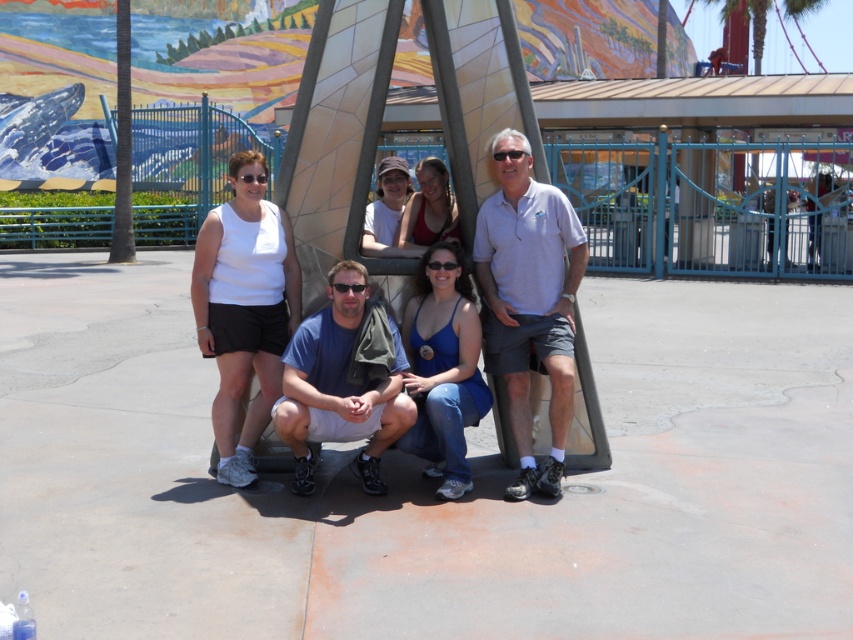
You are a photographer trying to capture a clear shot of both the gray cotton polo shirt at center and the blue fabric shirt at center. Which one should you focus on first to ensure both are in focus?

You should focus on the gray cotton polo shirt at center first since it is closer to the viewer than the blue fabric shirt at center, allowing the depth of field to also capture the latter in focus.

You are standing 5 meters away from a gray cotton polo shirt at center in the image. Can you reach it without moving closer?

The gray cotton polo shirt at center is 4.98 meters away from the viewer, so you are already within reach since you are standing 5 meters away. However, reaching it would require stretching or moving slightly closer depending on your arm length.

You are organizing a photo shoot and need to ensure that the blue fabric shirt at center and the matte white shirt at center are visible in the final image. Given their sizes, which shirt might be more likely to be fully visible in the photo?

The blue fabric shirt at center is bigger than the matte white shirt at center, so it might be more likely to be fully visible in the photo since its larger size could make it stand out more against the background.